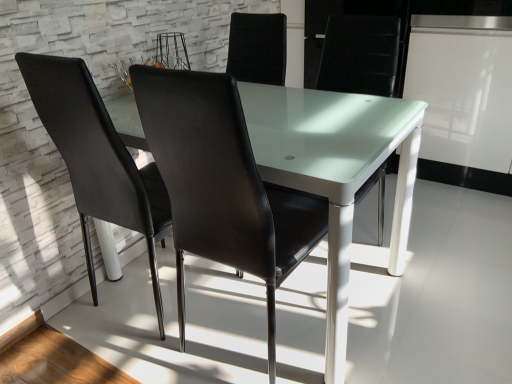
This screenshot has width=512, height=384. What are the coordinates of `transparent glass table at center` in the screenshot? It's located at (336, 154).

The width and height of the screenshot is (512, 384). Describe the element at coordinates (222, 185) in the screenshot. I see `black leather chair at center, which appears as the 1th chair when viewed from the right` at that location.

Identify the location of transparent glass table at center. The height and width of the screenshot is (384, 512). (336, 154).

Is black leather chair at left, placed as the second chair when sorted from right to left, oriented away from black leather chair at center, acting as the 2th chair starting from the left?

black leather chair at left, placed as the second chair when sorted from right to left, is not turned away from black leather chair at center, acting as the 2th chair starting from the left.

Are black leather chair at left, positioned as the first chair in left-to-right order, and black leather chair at center, acting as the 2th chair starting from the left, beside each other?

black leather chair at left, positioned as the first chair in left-to-right order, and black leather chair at center, acting as the 2th chair starting from the left, are not in contact.

From the image's perspective, is black leather chair at left, positioned as the first chair in left-to-right order, positioned above or below black leather chair at center, acting as the 2th chair starting from the left?

black leather chair at left, positioned as the first chair in left-to-right order, is above black leather chair at center, acting as the 2th chair starting from the left.

The image size is (512, 384). Identify the location of chair on the left of black leather chair at center, which appears as the 1th chair when viewed from the right. (97, 159).

Considering the sizes of objects black leather chair at left, positioned as the first chair in left-to-right order, and transparent glass table at center in the image provided, who is taller, black leather chair at left, positioned as the first chair in left-to-right order, or transparent glass table at center?

Standing taller between the two is black leather chair at left, positioned as the first chair in left-to-right order.

Is black leather chair at left, placed as the second chair when sorted from right to left, facing away from transparent glass table at center?

Correct, black leather chair at left, placed as the second chair when sorted from right to left, is looking away from transparent glass table at center.

Between black leather chair at left, placed as the second chair when sorted from right to left, and transparent glass table at center, which one has larger size?

transparent glass table at center is bigger.

Who is taller, transparent glass table at center or black leather chair at left, positioned as the first chair in left-to-right order?

Standing taller between the two is black leather chair at left, positioned as the first chair in left-to-right order.

From a real-world perspective, is transparent glass table at center located higher than black leather chair at left, positioned as the first chair in left-to-right order?

No, from a real-world perspective, transparent glass table at center is not over black leather chair at left, positioned as the first chair in left-to-right order

Is transparent glass table at center wider or thinner than black leather chair at left, positioned as the first chair in left-to-right order?

Clearly, transparent glass table at center has more width compared to black leather chair at left, positioned as the first chair in left-to-right order.

Visually, is transparent glass table at center positioned to the left or to the right of black leather chair at center, which appears as the 1th chair when viewed from the right?

From the image, it's evident that transparent glass table at center is to the left of black leather chair at center, which appears as the 1th chair when viewed from the right.

Looking at their sizes, would you say transparent glass table at center is wider or thinner than black leather chair at center, acting as the 2th chair starting from the left?

Clearly, transparent glass table at center has more width compared to black leather chair at center, acting as the 2th chair starting from the left.

Is transparent glass table at center positioned behind black leather chair at center, acting as the 2th chair starting from the left?

Yes, transparent glass table at center is further from the viewer.

From the picture: From a real-world perspective, is transparent glass table at center above or below black leather chair at center, which appears as the 1th chair when viewed from the right?

In terms of real-world spatial position, transparent glass table at center is below black leather chair at center, which appears as the 1th chair when viewed from the right.

Is black leather chair at center, which appears as the 1th chair when viewed from the right, oriented towards black leather chair at left, positioned as the first chair in left-to-right order?

No, black leather chair at center, which appears as the 1th chair when viewed from the right, is not aimed at black leather chair at left, positioned as the first chair in left-to-right order.

From the picture: Between black leather chair at center, acting as the 2th chair starting from the left, and black leather chair at left, placed as the second chair when sorted from right to left, which one has smaller width?

Thinner between the two is black leather chair at left, placed as the second chair when sorted from right to left.

Can you tell me how much black leather chair at center, which appears as the 1th chair when viewed from the right, and black leather chair at left, placed as the second chair when sorted from right to left, differ in facing direction?

The angle between the facing direction of black leather chair at center, which appears as the 1th chair when viewed from the right, and the facing direction of black leather chair at left, placed as the second chair when sorted from right to left, is 1.46 degrees.

Which object is positioned more to the left, black leather chair at center, which appears as the 1th chair when viewed from the right, or black leather chair at left, placed as the second chair when sorted from right to left?

black leather chair at left, placed as the second chair when sorted from right to left, is more to the left.

Does black leather chair at center, acting as the 2th chair starting from the left, have a smaller size compared to transparent glass table at center?

Indeed, black leather chair at center, acting as the 2th chair starting from the left, has a smaller size compared to transparent glass table at center.

Based on the photo, between black leather chair at center, which appears as the 1th chair when viewed from the right, and transparent glass table at center, which one has less height?

transparent glass table at center.

Identify the location of the 2nd chair directly above the transparent glass table at center (from a real-world perspective). (222, 185).

Locate an element on the screen. The image size is (512, 384). chair that appears on the right of black leather chair at left, placed as the second chair when sorted from right to left is located at coordinates (222, 185).

Find the location of a particular element. The image size is (512, 384). chair lying on the left of transparent glass table at center is located at coordinates (97, 159).

Looking at this image, which object lies nearer to the anchor point transparent glass table at center, black leather chair at center, which appears as the 1th chair when viewed from the right, or black leather chair at left, positioned as the first chair in left-to-right order?

black leather chair at center, which appears as the 1th chair when viewed from the right.

From the image, which object appears to be nearer to transparent glass table at center, black leather chair at left, placed as the second chair when sorted from right to left, or black leather chair at center, acting as the 2th chair starting from the left?

Among the two, black leather chair at center, acting as the 2th chair starting from the left, is located nearer to transparent glass table at center.

Looking at the image, which one is located further to black leather chair at center, which appears as the 1th chair when viewed from the right, transparent glass table at center or black leather chair at left, positioned as the first chair in left-to-right order?

black leather chair at left, positioned as the first chair in left-to-right order, is positioned further to the anchor black leather chair at center, which appears as the 1th chair when viewed from the right.

From the image, which object appears to be nearer to black leather chair at center, which appears as the 1th chair when viewed from the right, black leather chair at left, positioned as the first chair in left-to-right order, or transparent glass table at center?

transparent glass table at center.

From the image, which object appears to be farther from black leather chair at left, positioned as the first chair in left-to-right order, black leather chair at center, acting as the 2th chair starting from the left, or transparent glass table at center?

transparent glass table at center.

Estimate the real-world distances between objects in this image. Which object is closer to black leather chair at left, positioned as the first chair in left-to-right order, transparent glass table at center or black leather chair at center, which appears as the 1th chair when viewed from the right?

black leather chair at center, which appears as the 1th chair when viewed from the right, is positioned closer to the anchor black leather chair at left, positioned as the first chair in left-to-right order.

Locate an element on the screen. The width and height of the screenshot is (512, 384). round table between black leather chair at left, positioned as the first chair in left-to-right order, and black leather chair at center, which appears as the 1th chair when viewed from the right, from left to right is located at coordinates (336, 154).